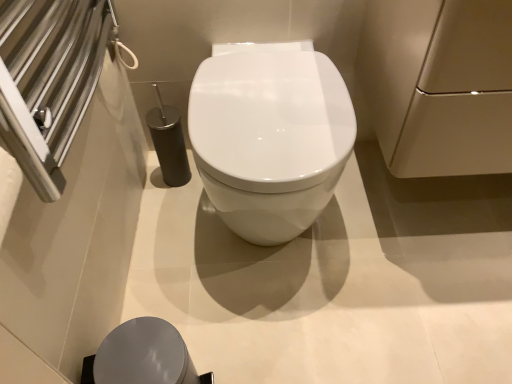
This screenshot has height=384, width=512. What do you see at coordinates (142, 356) in the screenshot?
I see `matte gray lid at lower center` at bounding box center [142, 356].

What is the approximate width of matte gray lid at lower center?

matte gray lid at lower center is 8.62 inches wide.

The width and height of the screenshot is (512, 384). Describe the element at coordinates (439, 84) in the screenshot. I see `matte beige cabinet at upper right` at that location.

Find the location of a particular element. white glossy toilet at center is located at coordinates (270, 136).

Is matte gray lid at lower center aimed at matte beige cabinet at upper right?

No, matte gray lid at lower center is not aimed at matte beige cabinet at upper right.

Where is `screen door above the matte gray lid at lower center (from the image's perspective)`? This screenshot has width=512, height=384. screen door above the matte gray lid at lower center (from the image's perspective) is located at coordinates (439, 84).

Between point (134, 355) and point (444, 154), which one is positioned behind?

Positioned behind is point (444, 154).

Which is more to the left, matte gray lid at lower center or matte beige cabinet at upper right?

Positioned to the left is matte gray lid at lower center.

Is matte beige cabinet at upper right at the left side of matte gray lid at lower center?

In fact, matte beige cabinet at upper right is to the right of matte gray lid at lower center.

Does matte beige cabinet at upper right have a greater height compared to matte gray lid at lower center?

Yes.

Is matte beige cabinet at upper right directly adjacent to matte gray lid at lower center?

matte beige cabinet at upper right is not next to matte gray lid at lower center, and they're not touching.

Would you say matte beige cabinet at upper right is inside or outside matte gray lid at lower center?

matte beige cabinet at upper right cannot be found inside matte gray lid at lower center.

Between matte beige cabinet at upper right and white glossy toilet at center, which one appears on the left side from the viewer's perspective?

white glossy toilet at center is more to the left.

Does matte beige cabinet at upper right have a lesser width compared to white glossy toilet at center?

Correct, the width of matte beige cabinet at upper right is less than that of white glossy toilet at center.

Choose the correct answer: Is matte beige cabinet at upper right inside white glossy toilet at center or outside it?

matte beige cabinet at upper right lies outside white glossy toilet at center.

Which point is more distant from viewer, (132, 365) or (221, 48)?

Point (221, 48)

Identify the location of porcelain that appears in front of the white glossy toilet at center. (142, 356).

Which is correct: matte gray lid at lower center is inside white glossy toilet at center, or outside of it?

matte gray lid at lower center lies outside white glossy toilet at center.

In the image, is white glossy toilet at center positioned in front of or behind matte beige cabinet at upper right?

A: Visually, white glossy toilet at center is located behind matte beige cabinet at upper right.

Considering the positions of objects white glossy toilet at center and matte beige cabinet at upper right in the image provided, who is more to the right, white glossy toilet at center or matte beige cabinet at upper right?

matte beige cabinet at upper right.

Which point is more forward, (217, 134) or (359, 58)?

Point (217, 134)

Do you think white glossy toilet at center is within matte beige cabinet at upper right, or outside of it?

The correct answer is: outside.

Is there a large distance between white glossy toilet at center and matte gray lid at lower center?

white glossy toilet at center is near matte gray lid at lower center, not far away.

Is white glossy toilet at center inside the boundaries of matte gray lid at lower center, or outside?

white glossy toilet at center cannot be found inside matte gray lid at lower center.

Could you tell me if white glossy toilet at center is facing matte gray lid at lower center?

Yes, white glossy toilet at center is oriented towards matte gray lid at lower center.

Considering the sizes of white glossy toilet at center and matte gray lid at lower center in the image, is white glossy toilet at center bigger or smaller than matte gray lid at lower center?

In the image, white glossy toilet at center appears to be larger than matte gray lid at lower center.

Locate an element on the screen. Image resolution: width=512 pixels, height=384 pixels. screen door that is in front of the matte gray lid at lower center is located at coordinates (439, 84).

At what (x,y) coordinates should I click in order to perform the action: click on porcelain below the matte beige cabinet at upper right (from the image's perspective). Please return your answer as a coordinate pair (x, y). This screenshot has width=512, height=384. Looking at the image, I should click on (142, 356).

Considering their positions, is matte beige cabinet at upper right positioned further to matte gray lid at lower center than white glossy toilet at center?

matte beige cabinet at upper right is positioned further to the anchor matte gray lid at lower center.

From the image, which object appears to be farther from white glossy toilet at center, matte gray lid at lower center or matte beige cabinet at upper right?

Based on the image, matte gray lid at lower center appears to be further to white glossy toilet at center.

Based on their spatial positions, is white glossy toilet at center or matte beige cabinet at upper right further from matte gray lid at lower center?

Among the two, matte beige cabinet at upper right is located further to matte gray lid at lower center.

Estimate the real-world distances between objects in this image. Which object is closer to matte beige cabinet at upper right, white glossy toilet at center or matte gray lid at lower center?

The object closer to matte beige cabinet at upper right is white glossy toilet at center.

Looking at the image, which one is located closer to white glossy toilet at center, matte beige cabinet at upper right or matte gray lid at lower center?

matte beige cabinet at upper right is positioned closer to the anchor white glossy toilet at center.

Considering their positions, is matte gray lid at lower center positioned closer to matte beige cabinet at upper right than white glossy toilet at center?

Based on the image, white glossy toilet at center appears to be nearer to matte beige cabinet at upper right.

Locate an element on the screen. This screenshot has height=384, width=512. toilet situated between matte gray lid at lower center and matte beige cabinet at upper right from left to right is located at coordinates (270, 136).